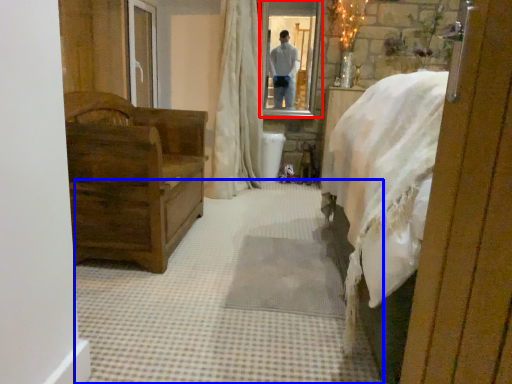
Question: Which object is closer to the camera taking this photo, mirror (highlighted by a red box) or plain (highlighted by a blue box)?

Choices:
 (A) mirror
 (B) plain

Answer: (B)